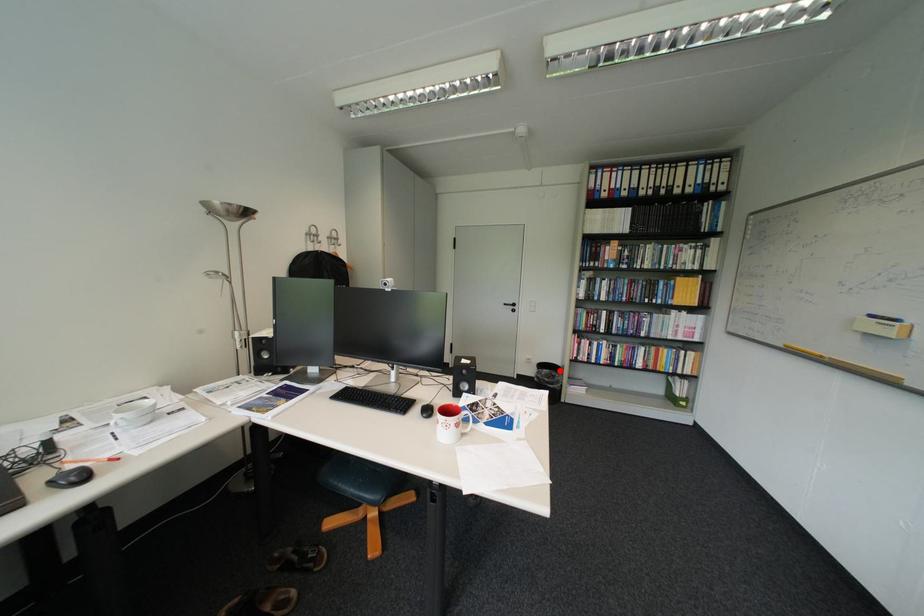
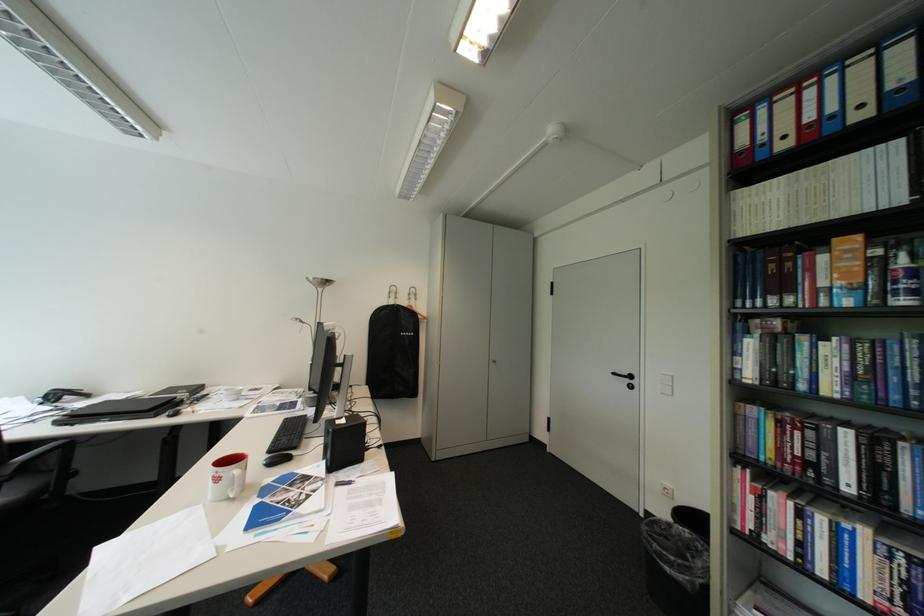
Find the pixel in the second image that matches the highlighted location in the first image.

(699, 531)